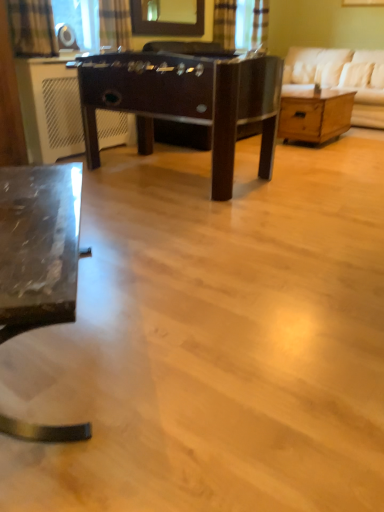
The width and height of the screenshot is (384, 512). Identify the location of free spot in front of dark brown wood foosball table at center, placed as the 2th table when sorted from back to front. (186, 240).